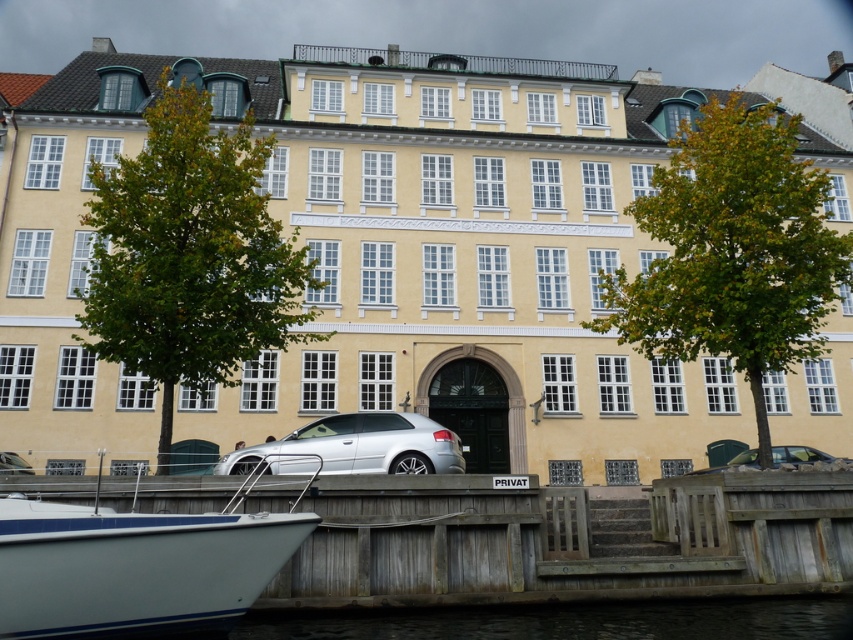
Question: Which object appears closest to the camera in this image?

Choices:
 (A) wooden dock at lower center
 (B) white glossy boat at lower left
 (C) silver metallic car at lower center
 (D) silver metallic hatchback at center

Answer: (B)

Question: Is white glossy boat at lower left thinner than silver metallic car at lower left?

Choices:
 (A) yes
 (B) no

Answer: (B)

Question: Among these points, which one is nearest to the camera?

Choices:
 (A) (813, 484)
 (B) (335, 432)
 (C) (21, 465)

Answer: (A)

Question: Estimate the real-world distances between objects in this image. Which object is closer to the silver metallic hatchback at center?

Choices:
 (A) silver metallic car at lower center
 (B) white glossy boat at lower left
 (C) silver metallic car at lower left

Answer: (B)

Question: From the image, what is the correct spatial relationship of white glossy boat at lower left in relation to silver metallic car at lower center?

Choices:
 (A) below
 (B) above

Answer: (B)

Question: Can you confirm if white glossy boat at lower left is wider than silver metallic car at lower left?

Choices:
 (A) no
 (B) yes

Answer: (B)